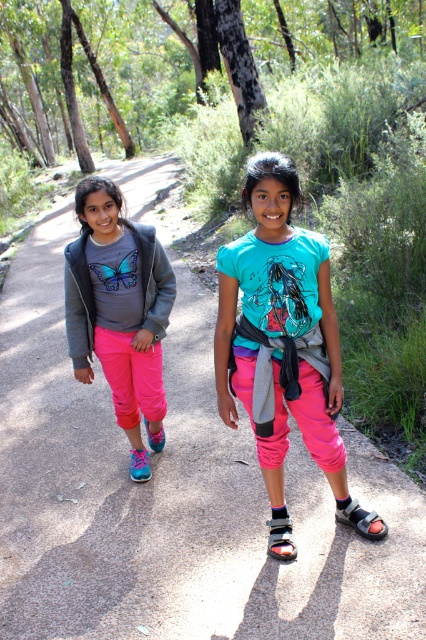
Is black leather sandal at lower right to the left of black leather sandal at lower center from the viewer's perspective?

No, black leather sandal at lower right is not to the left of black leather sandal at lower center.

The width and height of the screenshot is (426, 640). What do you see at coordinates (359, 518) in the screenshot? I see `black leather sandal at lower right` at bounding box center [359, 518].

Does point (357, 525) come behind point (273, 536)?

Yes, point (357, 525) is behind point (273, 536).

Where is `black leather sandal at lower right`? black leather sandal at lower right is located at coordinates (359, 518).

From the picture: Is the position of black leather sandal at lower center less distant than that of blue suede sandal at lower left?

Yes, it is in front of blue suede sandal at lower left.

Does point (290, 525) lie behind point (150, 433)?

That is False.

The height and width of the screenshot is (640, 426). I want to click on black leather sandal at lower center, so click(281, 538).

Between point (92, 346) and point (336, 513), which one is positioned behind?

The point (92, 346) is behind.

Can you confirm if matte gray jacket at center is smaller than black leather sandal at lower right?

No.

Is point (138, 365) positioned after point (362, 532)?

Yes, it is behind point (362, 532).

Where is `matte gray jacket at center`? matte gray jacket at center is located at coordinates (118, 305).